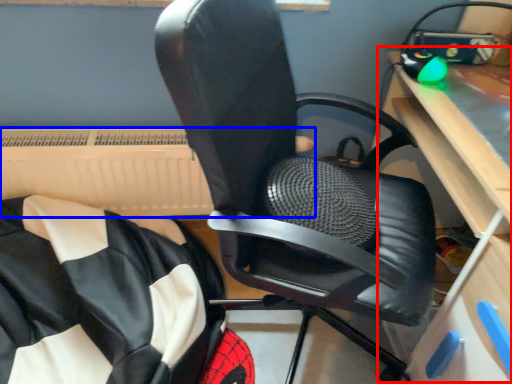
Question: Which object is closer to the camera taking this photo, computer desk (highlighted by a red box) or radiator (highlighted by a blue box)?

Choices:
 (A) computer desk
 (B) radiator

Answer: (A)